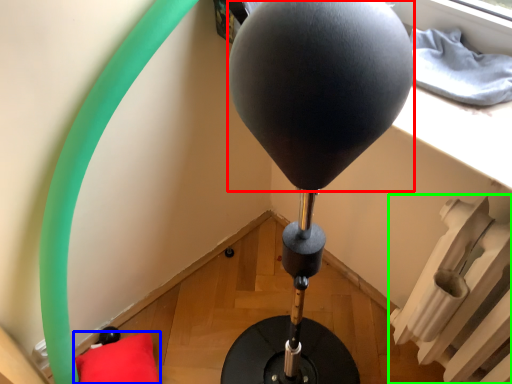
Question: Based on their relative distances, which object is farther from balloon (highlighted by a red box)? Choose from pillow (highlighted by a blue box) and radiator (highlighted by a green box).

Choices:
 (A) pillow
 (B) radiator

Answer: (A)